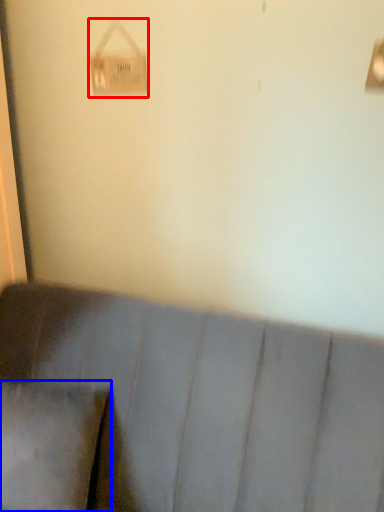
Question: Which of the following is the farthest to the observer, lamp (highlighted by a red box) or pillow (highlighted by a blue box)?

Choices:
 (A) lamp
 (B) pillow

Answer: (A)